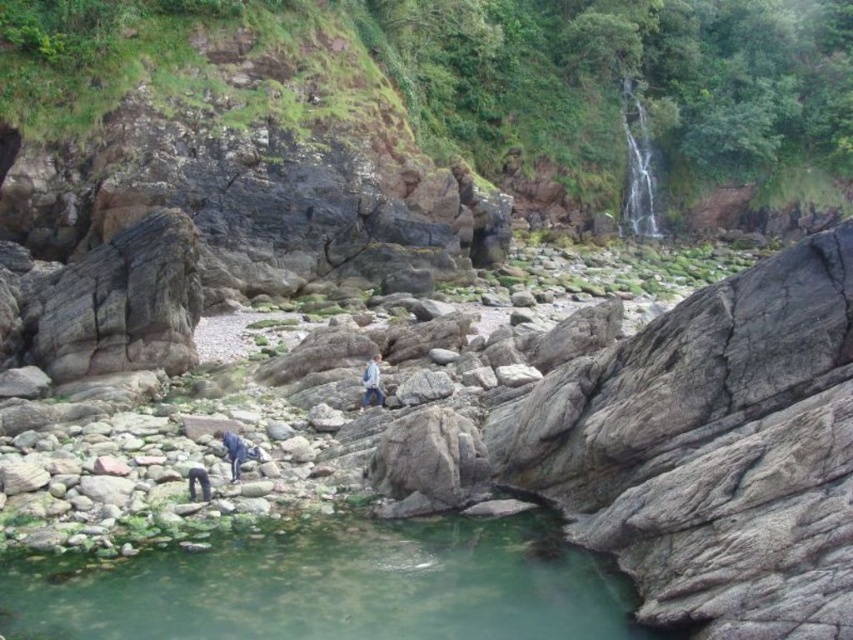
You are standing on the rocky shoreline and see the blue denim pants at lower left and the dark blue fabric person at lower left. Which object takes up more space in the image?

The blue denim pants at lower left takes up more space in the image because it is bigger than the dark blue fabric person at lower left.

You are standing at the edge of the rocky shoreline in the coastal scene. You see two points marked in the image. Which point, point (67, 563) or point (236, 444), is closer to you?

Point (67, 563) is closer to the viewer than point (236, 444).